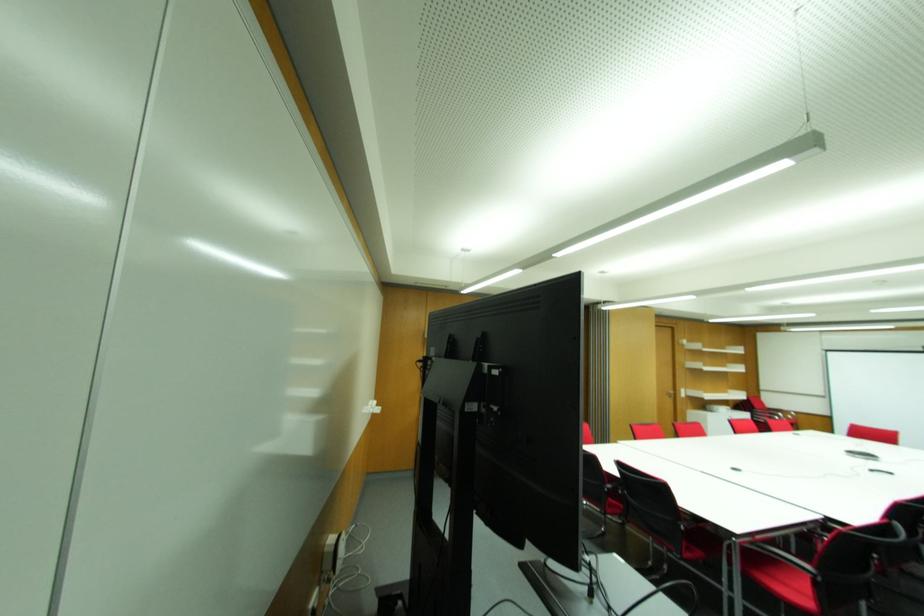
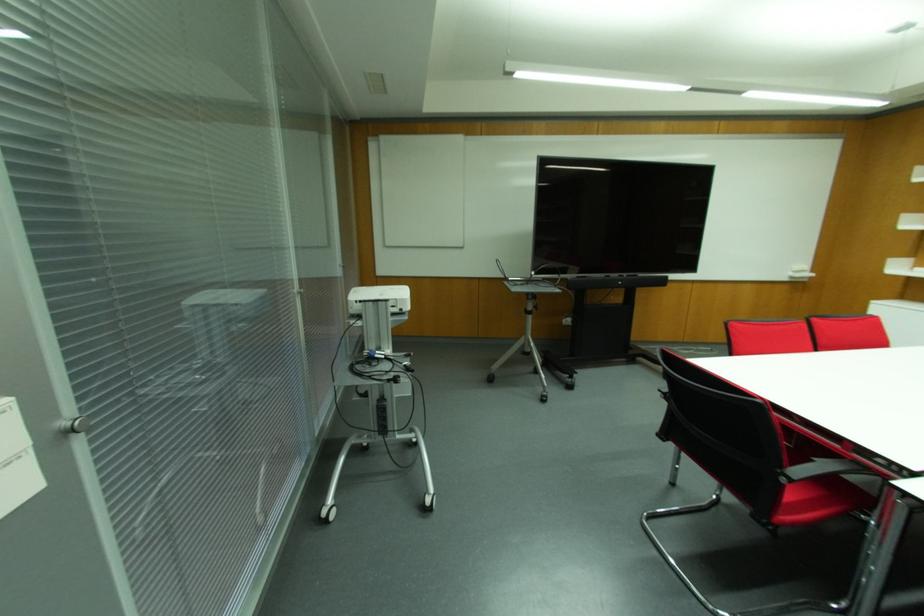
Where in the second image is the point corresponding to the point at 380,408 from the first image?

(811, 274)